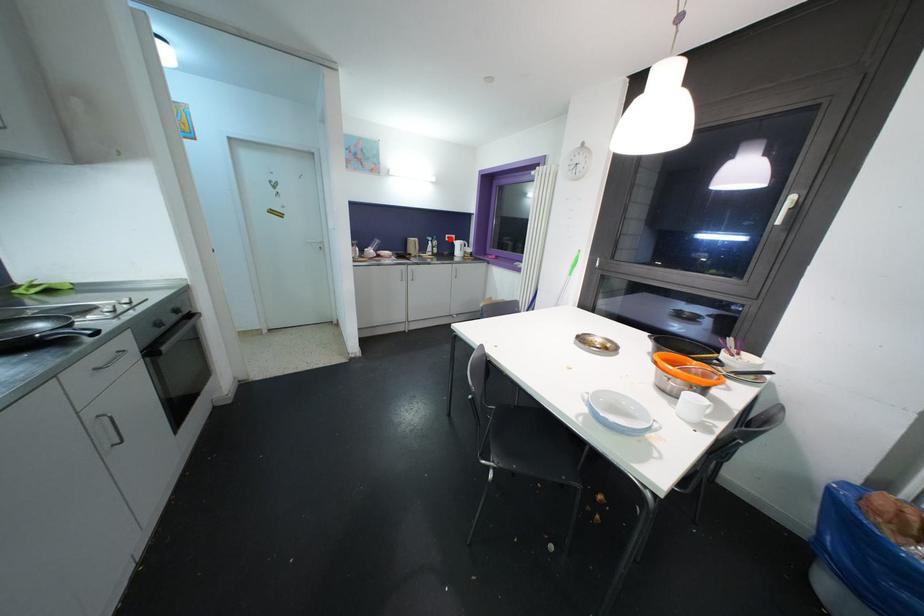
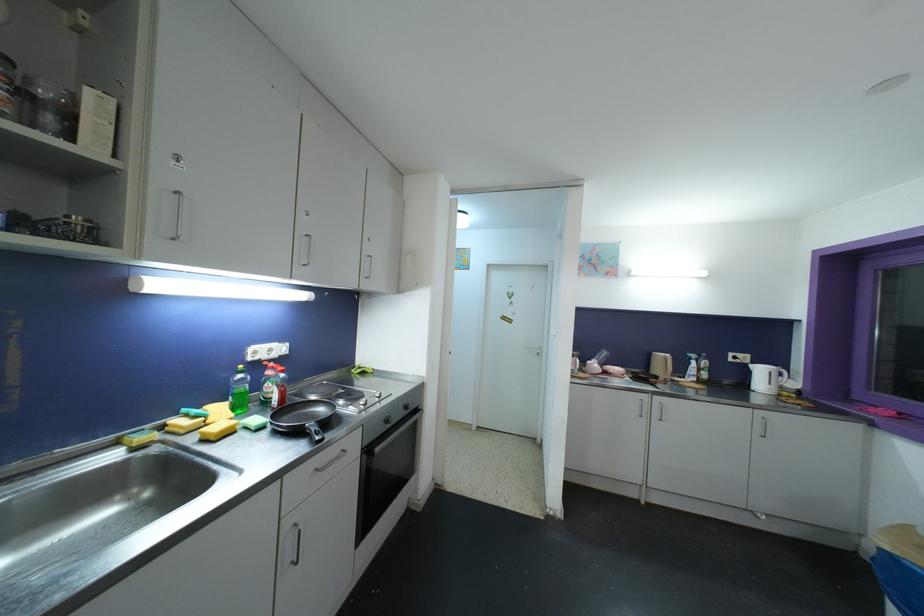
Question: I am providing you with two images of the same scene from different viewpoints. A red point is marked on the first image. Can you still see the location of the red point in image 2?

Choices:
 (A) Yes
 (B) No

Answer: (A)